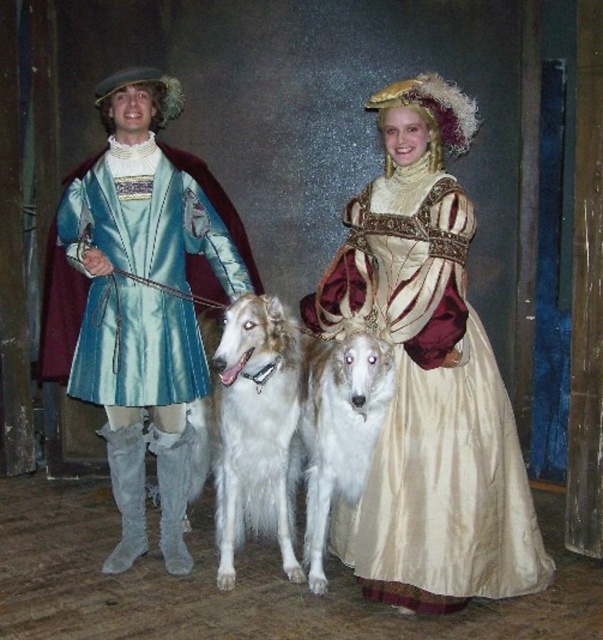
You are an event photographer at a Renaissance fair and need to capture a clear photo of both the white fluffy dog at center and the white fur dog at center. However, you notice that one of the dogs is blocking the other. Which dog is currently covering part of the other dog in the image?

The white fluffy dog at center is positioned over white fur dog at center, so it is covering part of the other dog.

You are a costume designer preparing for a play. You have two costumes available for the main character. The silky gold dress at center and the satin blue coat at left. The director wants to choose the costume that is more eye catching due to its size. Which one should you recommend?

The silky gold dress at center has a larger size compared to the satin blue coat at left, so it would be more eye catching due to its size.